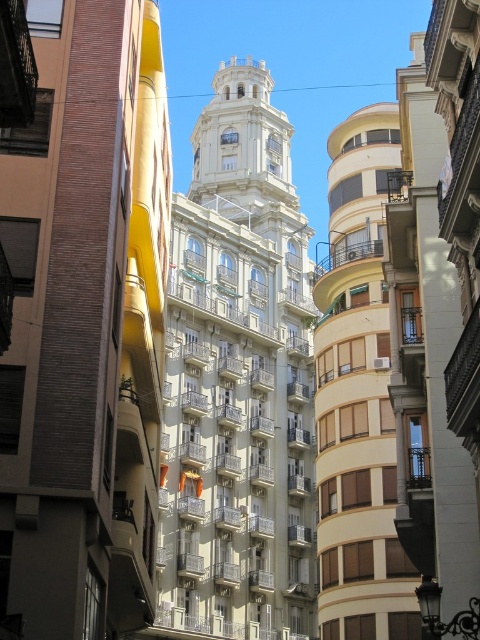
You are standing at the point marked by coordinates point (238, 381) in the urban scene. Based on the description, which building are you most likely facing?

You are facing the white textured building at center, as the coordinates point (238, 381) represent this building.

From the picture: You are standing in the city square and want to take a photo of the white textured building at center and the smooth beige balcony at right. Which one should you focus on first to ensure both are in the frame?

You should focus on the white textured building at center first since it is closer to you than the smooth beige balcony at right, ensuring both are in the frame.